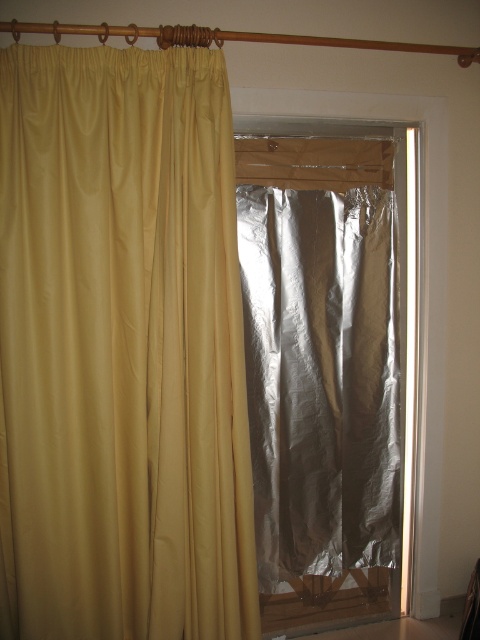
You are standing in the room and want to open the shiny metallic screen door at center. However, the matte yellow curtain at left might be blocking your path. Can you open the door without moving the curtain?

The matte yellow curtain at left is positioned over the shiny metallic screen door at center, so you would need to move the curtain to access the door.

You are standing in a room with a window. You see a matte yellow curtain at left and a shiny metallic screen door at center. Which object is closer to the window frame on the left side?

The matte yellow curtain at left is closer to the window frame on the left side because it is positioned on the left side of the shiny metallic screen door at center.

You are standing in the room and want to know the exact coordinates of the matte yellow curtain at left. What are its coordinates?

The coordinates of the matte yellow curtain at left are at point (121,348).